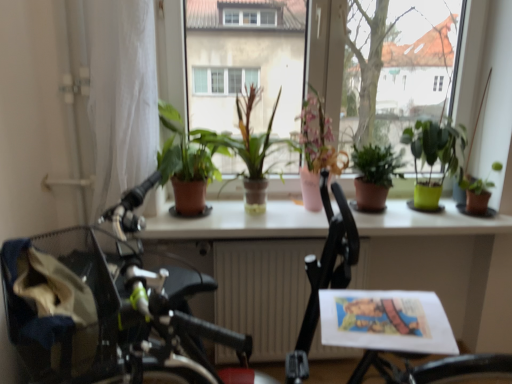
The height and width of the screenshot is (384, 512). What are the coordinates of `vacant space underneath green matte plant at center, which is counted as the 5th houseplant, starting from the right (from a real-world perspective)` in the screenshot? It's located at (246, 209).